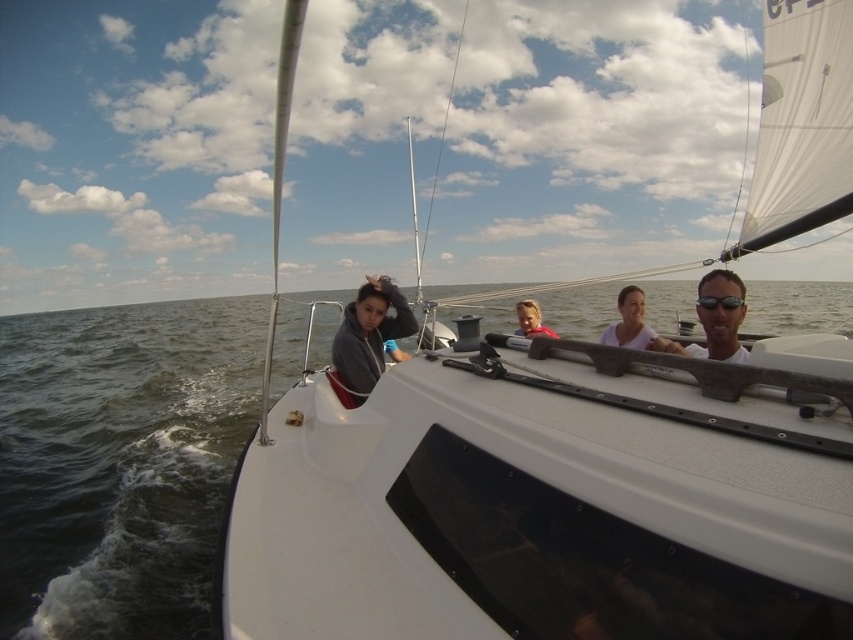
Who is shorter, dark gray water at center or black rubber goggles at upper right?

Standing shorter between the two is black rubber goggles at upper right.

Between point (148, 538) and point (718, 298), which one is positioned in front?

Point (718, 298) is more forward.

Image resolution: width=853 pixels, height=640 pixels. Find the location of `dark gray water at center`. dark gray water at center is located at coordinates (102, 442).

Consider the image. Is dark gray water at center thinner than gray fleece jacket at center?

Incorrect, dark gray water at center's width is not less than gray fleece jacket at center's.

Does dark gray water at center lie behind gray fleece jacket at center?

No, it is in front of gray fleece jacket at center.

This screenshot has height=640, width=853. What do you see at coordinates (102, 442) in the screenshot?
I see `dark gray water at center` at bounding box center [102, 442].

Identify the location of dark gray water at center. (102, 442).

Who is taller, gray fleece jacket at center or black rubber goggles at upper right?

With more height is gray fleece jacket at center.

At what (x,y) coordinates should I click in order to perform the action: click on gray fleece jacket at center. Please return your answer as a coordinate pair (x, y). This screenshot has height=640, width=853. Looking at the image, I should click on (367, 337).

This screenshot has height=640, width=853. I want to click on gray fleece jacket at center, so click(367, 337).